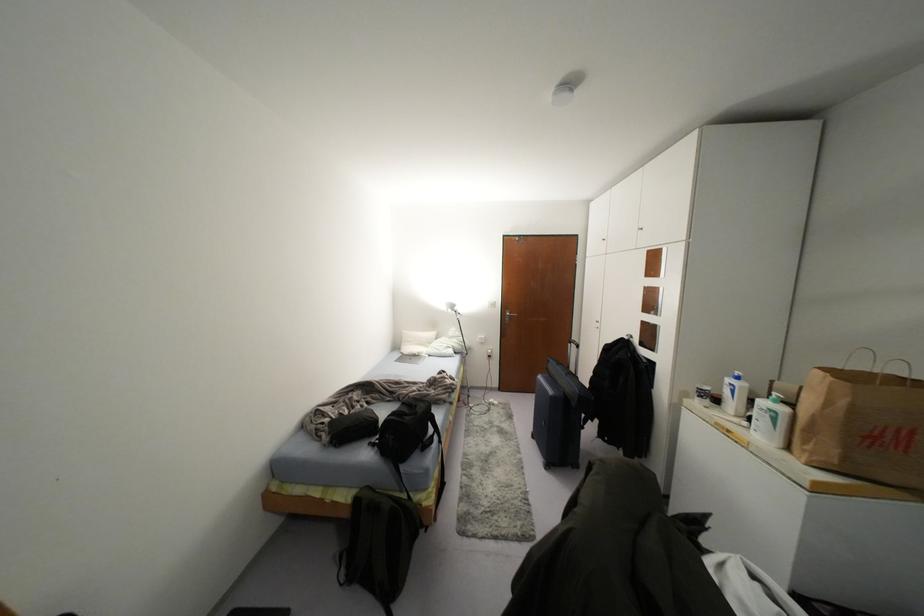
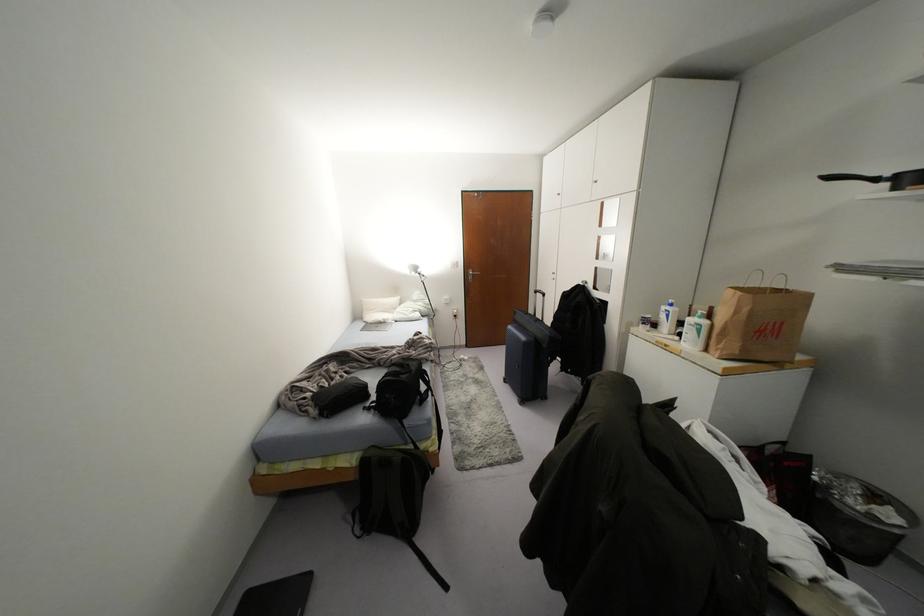
Find the pixel in the second image that matches point (782, 408) in the first image.

(703, 322)